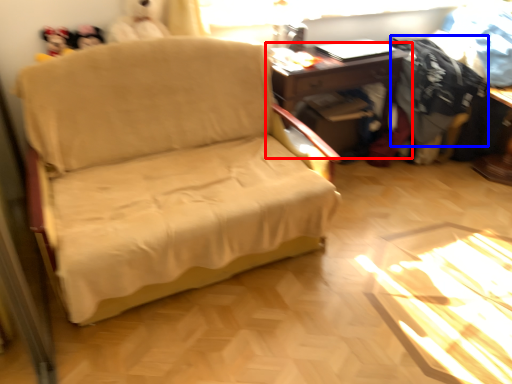
Question: Among these objects, which one is nearest to the camera, table (highlighted by a red box) or clothing (highlighted by a blue box)?

Choices:
 (A) table
 (B) clothing

Answer: (A)